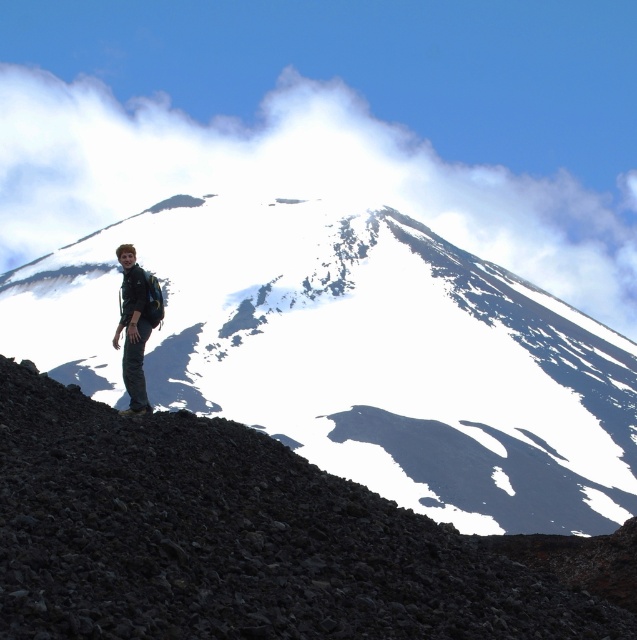
Which is more to the left, white fluffy cloud at upper center or matte black jacket at lower left?

From the viewer's perspective, white fluffy cloud at upper center appears more on the left side.

Who is more forward, [561,173] or [129,410]?

Point [129,410] is more forward.

Locate an element on the screen. The image size is (637, 640). white fluffy cloud at upper center is located at coordinates (292, 179).

Locate an element on the screen. snowy rocky mountain at center is located at coordinates (355, 355).

Does point (469, 435) come in front of point (124, 365)?

No.

I want to click on snowy rocky mountain at center, so click(x=355, y=355).

Can you confirm if snowy rocky mountain at center is bigger than dark gray gravel at lower left?

Yes.

Between point (396, 220) and point (168, 577), which one is positioned behind?

Point (396, 220)

Image resolution: width=637 pixels, height=640 pixels. Identify the location of snowy rocky mountain at center. (355, 355).